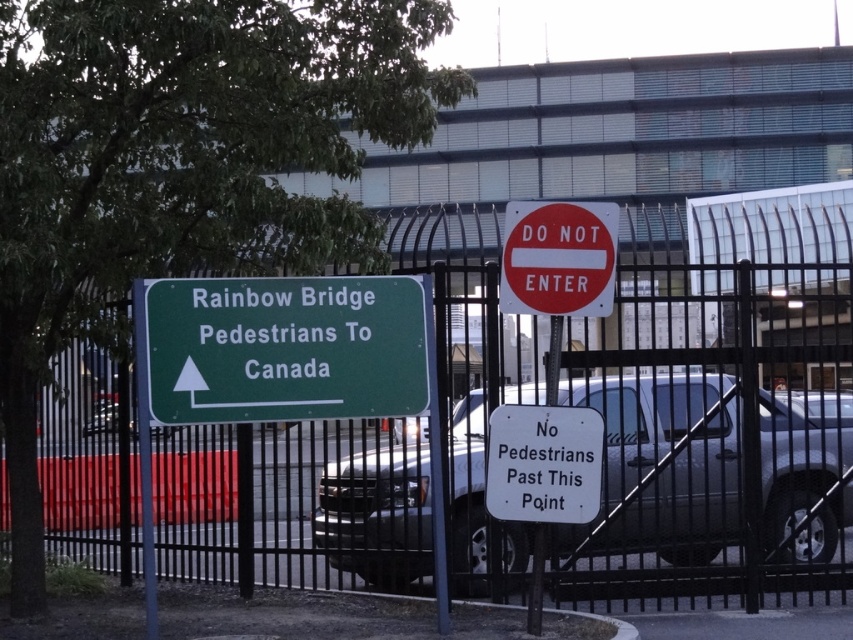
Question: Which point appears closest to the camera in this image?

Choices:
 (A) (547, 268)
 (B) (201, 296)
 (C) (817, 524)
 (D) (561, 432)

Answer: (B)

Question: Considering the real-world distances, which object is closest to the white plastic sign at center?

Choices:
 (A) red matte sign at center
 (B) silver metallic truck at center
 (C) green metallic sign at upper left

Answer: (A)

Question: Is black metal fence at center bigger than silver metallic truck at center?

Choices:
 (A) yes
 (B) no

Answer: (B)

Question: Considering the real-world distances, which object is closest to the green metallic sign at upper left?

Choices:
 (A) white plastic sign at center
 (B) black metal fence at center
 (C) red matte sign at center
 (D) silver metallic truck at center

Answer: (A)

Question: Is black metal fence at center to the right of white plastic sign at center from the viewer's perspective?

Choices:
 (A) no
 (B) yes

Answer: (B)

Question: Is green metallic sign at upper left bigger than white plastic sign at center?

Choices:
 (A) no
 (B) yes

Answer: (B)